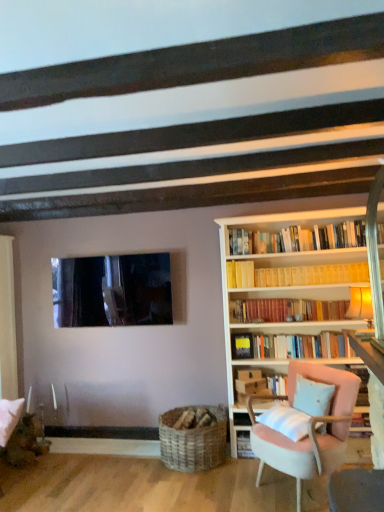
Measure the distance between point (349, 401) and camera.

They are 10.13 feet apart.

The width and height of the screenshot is (384, 512). Describe the element at coordinates (297, 275) in the screenshot. I see `yellow paperbacks at upper center, acting as the first book starting from the top` at that location.

Image resolution: width=384 pixels, height=512 pixels. Find the location of `light blue fabric pillow at lower right`. light blue fabric pillow at lower right is located at coordinates (313, 397).

The image size is (384, 512). What do you see at coordinates (293, 346) in the screenshot?
I see `hardcover books at center, acting as the second book starting from the top` at bounding box center [293, 346].

The image size is (384, 512). Find the location of `transparent glass window at upper center`. transparent glass window at upper center is located at coordinates [x=112, y=290].

How distant is yellow paperbacks at upper center, acting as the first book starting from the top, from pink fabric chair at right?

They are 1.09 meters apart.

Considering the sizes of yellow paperbacks at upper center, acting as the first book starting from the top, and pink fabric chair at right in the image, is yellow paperbacks at upper center, acting as the first book starting from the top, bigger or smaller than pink fabric chair at right?

Considering their sizes, yellow paperbacks at upper center, acting as the first book starting from the top, takes up less space than pink fabric chair at right.

From the image's perspective, which is above, yellow paperbacks at upper center, acting as the first book starting from the top, or pink fabric chair at right?

yellow paperbacks at upper center, acting as the first book starting from the top, appears higher in the image.

Where is `the 2nd book directly above the pink fabric chair at right (from a real-world perspective)`? the 2nd book directly above the pink fabric chair at right (from a real-world perspective) is located at coordinates (297, 275).

Choose the correct answer: Is hardcover books at center, placed as the first book when sorted from bottom to top, inside light blue fabric pillow at lower right or outside it?

hardcover books at center, placed as the first book when sorted from bottom to top, is not inside light blue fabric pillow at lower right, it's outside.

Is hardcover books at center, placed as the first book when sorted from bottom to top, turned away from light blue fabric pillow at lower right?

No, hardcover books at center, placed as the first book when sorted from bottom to top,'s orientation is not away from light blue fabric pillow at lower right.

Can you tell me how much hardcover books at center, acting as the second book starting from the top, and light blue fabric pillow at lower right differ in facing direction?

There is a 49.7-degree angle between the facing directions of hardcover books at center, acting as the second book starting from the top, and light blue fabric pillow at lower right.

Can you confirm if hardcover books at center, acting as the second book starting from the top, is wider than light blue fabric pillow at lower right?

No.

Where is `chair on the left of hardcover books at center, placed as the first book when sorted from bottom to top`? chair on the left of hardcover books at center, placed as the first book when sorted from bottom to top is located at coordinates (308, 429).

Is there a large distance between hardcover books at center, acting as the second book starting from the top, and pink fabric chair at right?

That's not correct — hardcover books at center, acting as the second book starting from the top, is a little close to pink fabric chair at right.

Is point (165, 418) closer or farther from the camera than point (325, 412)?

Point (165, 418) appears to be farther away from the viewer than point (325, 412).

Which object is positioned more to the right, woven wood basket at lower center or light blue fabric pillow at lower right?

light blue fabric pillow at lower right.

Does woven wood basket at lower center turn towards light blue fabric pillow at lower right?

No, woven wood basket at lower center is not oriented towards light blue fabric pillow at lower right.

What's the angular difference between woven wood basket at lower center and light blue fabric pillow at lower right's facing directions?

They differ by 44.4 degrees in their facing directions.

Is point (194, 440) closer to camera compared to point (66, 293)?

Yes, point (194, 440) is closer to viewer.

Consider the image. How distant is woven wood basket at lower center from transparent glass window at upper center?

A distance of 1.24 meters exists between woven wood basket at lower center and transparent glass window at upper center.

From the image's perspective, is woven wood basket at lower center positioned above or below transparent glass window at upper center?

Clearly, from the image's perspective, woven wood basket at lower center is below transparent glass window at upper center.

Is woven wood basket at lower center closer to camera compared to transparent glass window at upper center?

Yes, woven wood basket at lower center is in front of transparent glass window at upper center.

Looking at their sizes, would you say transparent glass window at upper center is wider or thinner than woven wood basket at lower center?

transparent glass window at upper center is thinner than woven wood basket at lower center.

You are a GUI agent. You are given a task and a screenshot of the screen. Output one action in this format:
    pyautogui.click(x=<x>, y=<y>)
    Task: Click on the window above the woven wood basket at lower center (from a real-world perspective)
    This screenshot has height=512, width=384.
    Given the screenshot: What is the action you would take?
    pyautogui.click(x=112, y=290)

From the picture: Considering the positions of objects transparent glass window at upper center and woven wood basket at lower center in the image provided, who is more to the right, transparent glass window at upper center or woven wood basket at lower center?

Positioned to the right is woven wood basket at lower center.

Considering the sizes of objects woven wood basket at lower center and pink fabric chair at right in the image provided, who is thinner, woven wood basket at lower center or pink fabric chair at right?

woven wood basket at lower center is thinner.

Which is nearer, (211,442) or (297,490)?

Point (211,442) is positioned farther from the camera compared to point (297,490).

Consider the image. Is woven wood basket at lower center in front of pink fabric chair at right?

No, woven wood basket at lower center is behind pink fabric chair at right.

From a real-world perspective, which object rests below the other?

From a 3D spatial view, woven wood basket at lower center is below.

What are the coordinates of `the 2nd book to the right when counting from the pink fabric chair at right` in the screenshot? It's located at (297, 275).

Identify the location of the 2nd book behind the light blue fabric pillow at lower right, starting your count from the anchor. (293, 346).

When comparing their distances from yellow paperbacks at upper center, the 2th book ordered from the bottom, does light blue fabric pillow at lower right or woven wood basket at lower center seem further?

The object further to yellow paperbacks at upper center, the 2th book ordered from the bottom, is woven wood basket at lower center.

Based on their spatial positions, is pink fabric chair at right or yellow paperbacks at upper center, the 2th book ordered from the bottom, further from hardcover books at center, placed as the first book when sorted from bottom to top?

The object further to hardcover books at center, placed as the first book when sorted from bottom to top, is pink fabric chair at right.

When comparing their distances from yellow paperbacks at upper center, acting as the first book starting from the top, does transparent glass window at upper center or hardcover books at center, acting as the second book starting from the top, seem closer?

The object closer to yellow paperbacks at upper center, acting as the first book starting from the top, is hardcover books at center, acting as the second book starting from the top.

Looking at the image, which one is located closer to light blue fabric pillow at lower right, pink fabric chair at right or hardcover books at center, acting as the second book starting from the top?

pink fabric chair at right lies closer to light blue fabric pillow at lower right than the other object.

Based on their spatial positions, is pink fabric chair at right or transparent glass window at upper center closer to yellow paperbacks at upper center, acting as the first book starting from the top?

Among the two, pink fabric chair at right is located nearer to yellow paperbacks at upper center, acting as the first book starting from the top.

Which object lies further to the anchor point yellow paperbacks at upper center, acting as the first book starting from the top, light blue fabric pillow at lower right or pink fabric chair at right?

pink fabric chair at right lies further to yellow paperbacks at upper center, acting as the first book starting from the top, than the other object.

In the scene shown: When comparing their distances from woven wood basket at lower center, does pink fabric chair at right or yellow paperbacks at upper center, acting as the first book starting from the top, seem further?

yellow paperbacks at upper center, acting as the first book starting from the top, is positioned further to the anchor woven wood basket at lower center.

When comparing their distances from pink fabric chair at right, does transparent glass window at upper center or yellow paperbacks at upper center, the 2th book ordered from the bottom, seem further?

transparent glass window at upper center is positioned further to the anchor pink fabric chair at right.

Where is `chair located between woven wood basket at lower center and hardcover books at center, acting as the second book starting from the top, in the left-right direction`? chair located between woven wood basket at lower center and hardcover books at center, acting as the second book starting from the top, in the left-right direction is located at coordinates (308, 429).

At what (x,y) coordinates should I click in order to perform the action: click on basket situated between transparent glass window at upper center and hardcover books at center, acting as the second book starting from the top, from left to right. Please return your answer as a coordinate pair (x, y). This screenshot has width=384, height=512. Looking at the image, I should click on (193, 441).

Where is `pillow between transparent glass window at upper center and hardcover books at center, placed as the first book when sorted from bottom to top, in the horizontal direction`? The width and height of the screenshot is (384, 512). pillow between transparent glass window at upper center and hardcover books at center, placed as the first book when sorted from bottom to top, in the horizontal direction is located at coordinates (313, 397).

Where is `chair between transparent glass window at upper center and yellow paperbacks at upper center, acting as the first book starting from the top, in the horizontal direction`? The width and height of the screenshot is (384, 512). chair between transparent glass window at upper center and yellow paperbacks at upper center, acting as the first book starting from the top, in the horizontal direction is located at coordinates (308, 429).